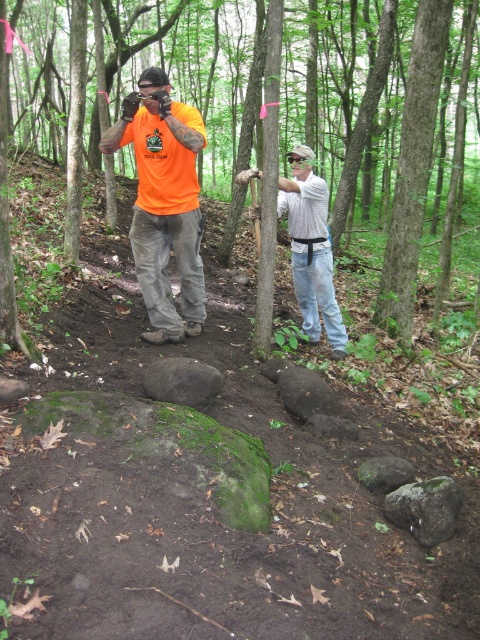
Question: Which point is farther from the camera taking this photo?

Choices:
 (A) (400, 472)
 (B) (421, 516)
 (C) (380, 124)

Answer: (C)

Question: Which point appears farthest from the camera in this image?

Choices:
 (A) (195, 378)
 (B) (410, 177)

Answer: (B)

Question: Is smooth bark tree at center closer to camera compared to gray rough rock at center?

Choices:
 (A) yes
 (B) no

Answer: (B)

Question: Can you confirm if green mossy rock at lower center is positioned below gray rough rock at center?

Choices:
 (A) yes
 (B) no

Answer: (B)

Question: Is orange t-shirt at center positioned behind white textured shirt at center?

Choices:
 (A) no
 (B) yes

Answer: (A)

Question: Which point is farther to the camera?

Choices:
 (A) (450, 132)
 (B) (332, 300)

Answer: (A)